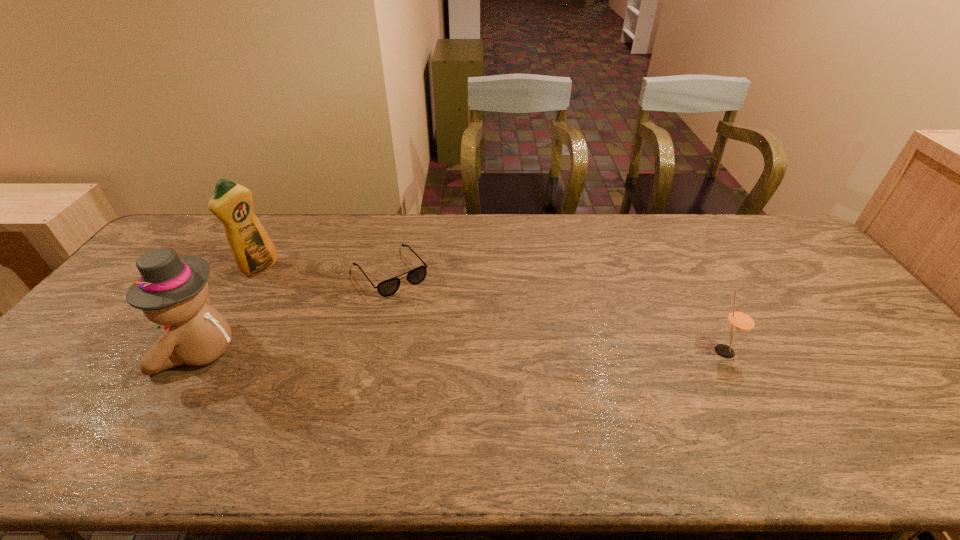
Identify the location of rag_doll. (172, 291).

Locate an element on the screen. Image resolution: width=960 pixels, height=540 pixels. straw is located at coordinates point(741,320).

Where is `the rightmost object`? This screenshot has width=960, height=540. the rightmost object is located at coordinates (741, 320).

The width and height of the screenshot is (960, 540). Find the location of `spectacles`. spectacles is located at coordinates (388, 287).

The width and height of the screenshot is (960, 540). What are the coordinates of `the second object from right to left` in the screenshot? It's located at (388, 287).

At what (x,y) coordinates should I click in order to perform the action: click on detergent. Please return your answer as a coordinate pair (x, y). This screenshot has width=960, height=540. Looking at the image, I should click on (232, 203).

At what (x,y) coordinates should I click in order to perform the action: click on vacant space located 0.110m on the front-facing side of the rag_doll. Please return your answer as a coordinate pair (x, y). This screenshot has height=540, width=960. Looking at the image, I should click on (119, 351).

Where is `vacant region located on the front-facing side of the rag_doll`? Image resolution: width=960 pixels, height=540 pixels. vacant region located on the front-facing side of the rag_doll is located at coordinates (123, 351).

What are the coordinates of `vacant region located 0.130m on the front-facing side of the rag_doll` in the screenshot? It's located at (111, 351).

Image resolution: width=960 pixels, height=540 pixels. Find the location of `free space located 0.320m on the right of the straw`. free space located 0.320m on the right of the straw is located at coordinates (859, 351).